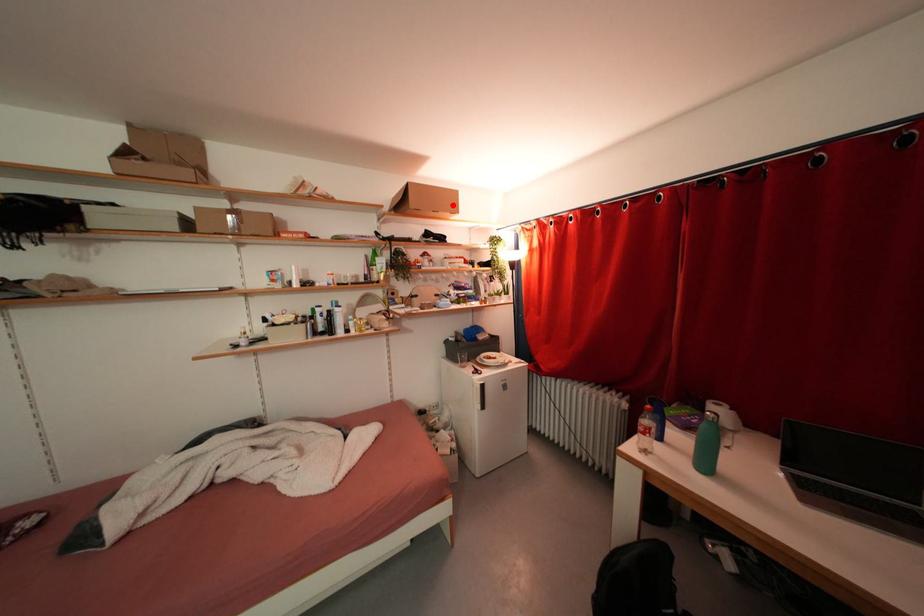
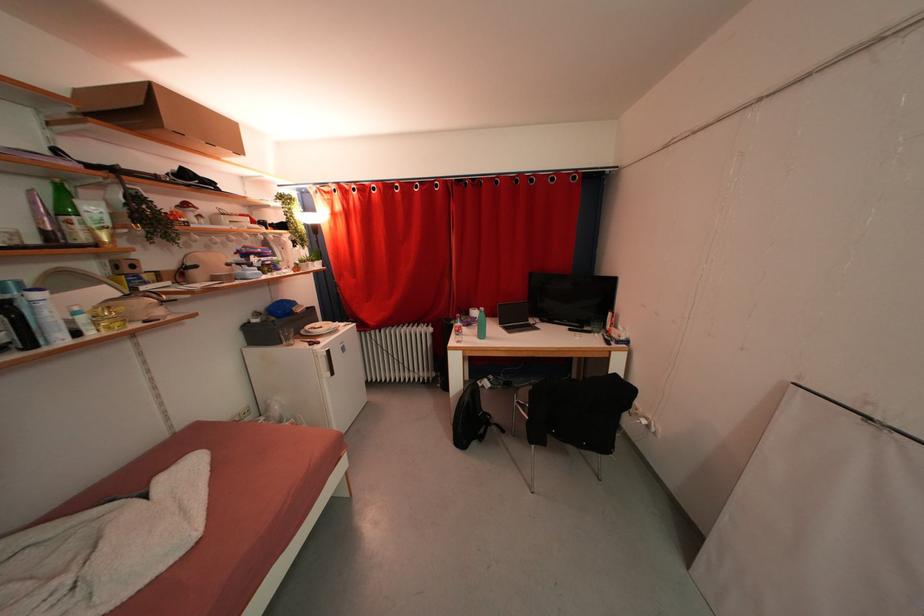
Find the pixel in the second image that matches the highlighted location in the first image.

(226, 137)